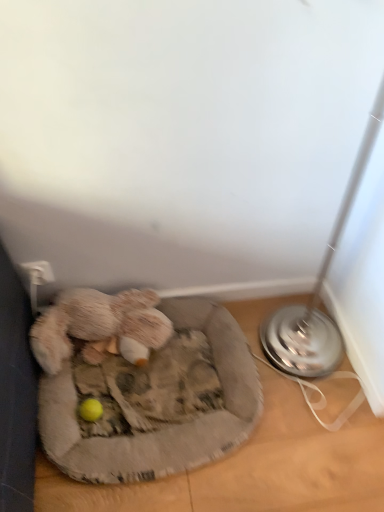
Locate an element on the screen. The width and height of the screenshot is (384, 512). free spot to the right of fluffy gray dog bed at lower left is located at coordinates (305, 402).